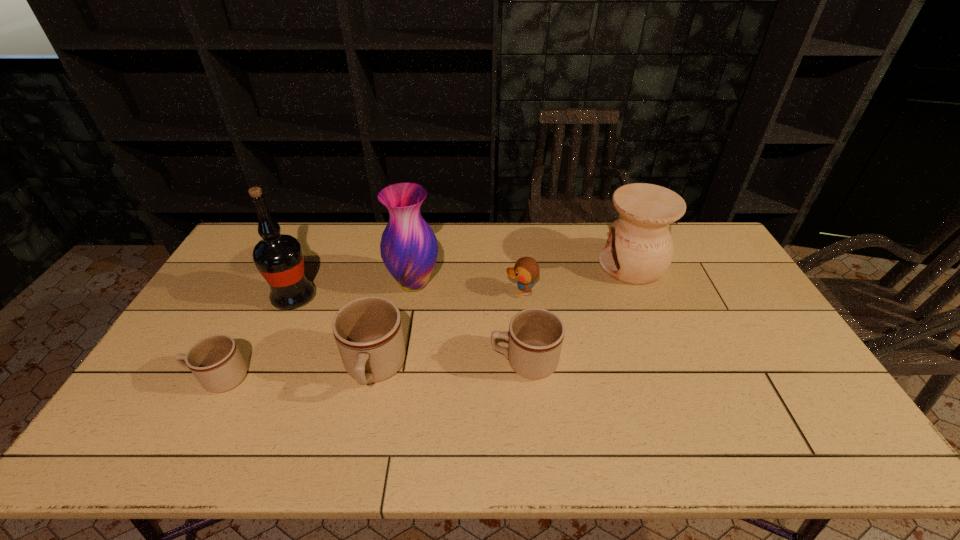
Locate an element on the screen. The width and height of the screenshot is (960, 540). free location located on the side of the shortest mug with the handle is located at coordinates (150, 378).

Identify the location of free space located on the side of the second tallest mug with the handle. Image resolution: width=960 pixels, height=540 pixels. (351, 362).

The width and height of the screenshot is (960, 540). In order to click on blank space located 0.350m on the side of the second tallest mug with the handle in this screenshot , I will do `click(362, 362)`.

What are the coordinates of `free location located 0.070m on the side of the second tallest mug with the handle` in the screenshot? It's located at (465, 362).

At what (x,y) coordinates should I click in order to perform the action: click on blank space located 0.100m on the front-facing side of the duck. Please return your answer as a coordinate pair (x, y). The width and height of the screenshot is (960, 540). Looking at the image, I should click on (474, 292).

Where is `free spot located on the front-facing side of the duck`? free spot located on the front-facing side of the duck is located at coordinates (394, 292).

Where is `vacant area situated 0.130m on the front-facing side of the duck`? vacant area situated 0.130m on the front-facing side of the duck is located at coordinates (465, 292).

The image size is (960, 540). Find the location of `vacant space located 0.290m on the right of the wine bottle`. vacant space located 0.290m on the right of the wine bottle is located at coordinates (407, 298).

I want to click on vacant region located on the back of the sixth shortest object, so click(422, 231).

The width and height of the screenshot is (960, 540). Identify the location of free point located at the open side of the rightmost object. (512, 265).